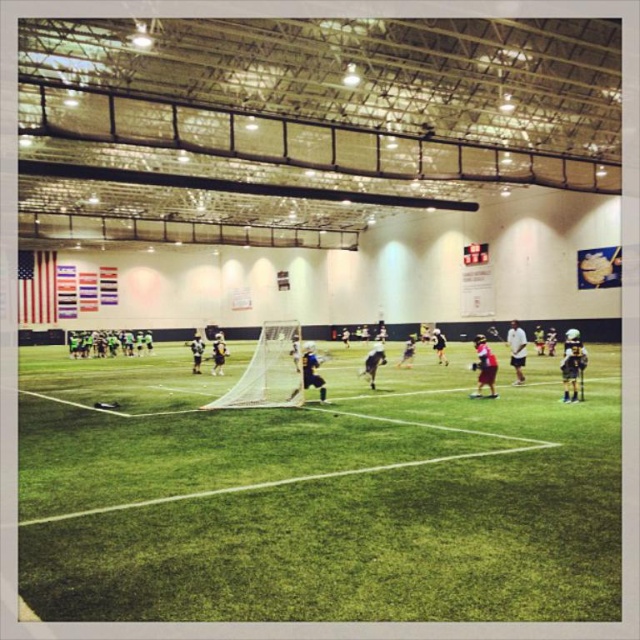
Question: From the image, what is the correct spatial relationship of green artificial turf at center in relation to white mesh net at center?

Choices:
 (A) left
 (B) right

Answer: (B)

Question: Where is green artificial turf at center located in relation to white mesh net at center in the image?

Choices:
 (A) left
 (B) right

Answer: (B)

Question: Which point is farther from the camera taking this photo?

Choices:
 (A) (259, 342)
 (B) (593, 592)

Answer: (A)

Question: Which object is closer to the camera taking this photo?

Choices:
 (A) white mesh net at center
 (B) green artificial turf at center

Answer: (B)

Question: In this image, where is green artificial turf at center located relative to white mesh net at center?

Choices:
 (A) right
 (B) left

Answer: (A)